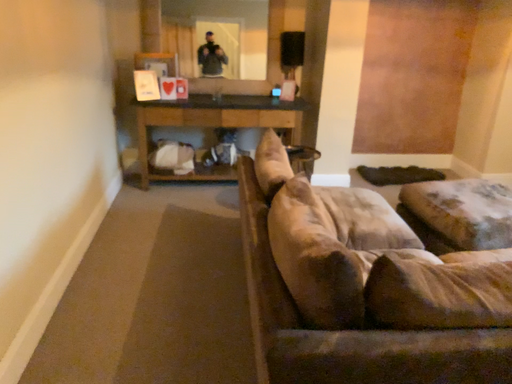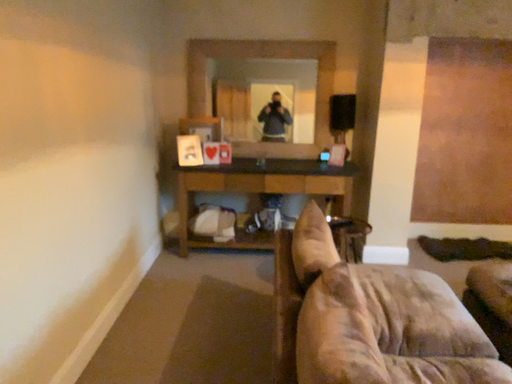
Question: How did the camera likely rotate when shooting the video?

Choices:
 (A) rotated right
 (B) rotated left

Answer: (B)